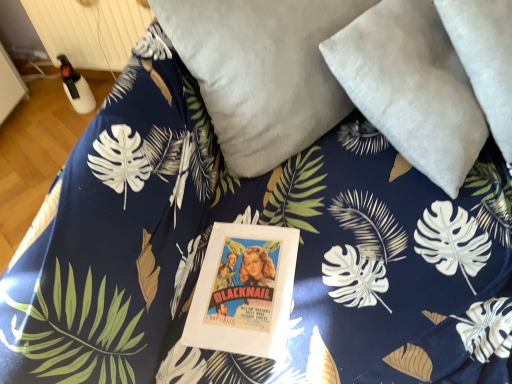
Question: Can you confirm if white plastic radiator at upper left is positioned to the left of velvety gray pillow at upper center, marked as the 1th pillow in a left-to-right arrangement?

Choices:
 (A) yes
 (B) no

Answer: (A)

Question: From a real-world perspective, is white plastic radiator at upper left on velvety gray pillow at upper center, the second pillow in the right-to-left sequence?

Choices:
 (A) no
 (B) yes

Answer: (A)

Question: Is white plastic radiator at upper left further to the viewer compared to velvety gray pillow at upper center, marked as the 1th pillow in a left-to-right arrangement?

Choices:
 (A) yes
 (B) no

Answer: (A)

Question: From the image's perspective, would you say white plastic radiator at upper left is shown under velvety gray pillow at upper center, marked as the 1th pillow in a left-to-right arrangement?

Choices:
 (A) no
 (B) yes

Answer: (A)

Question: From the image's perspective, would you say white plastic radiator at upper left is positioned over velvety gray pillow at upper center, the second pillow in the right-to-left sequence?

Choices:
 (A) yes
 (B) no

Answer: (A)

Question: Which is correct: velvety gray pillow at upper center, marked as the 1th pillow in a left-to-right arrangement, is inside suede-like gray pillow at upper right, the first pillow positioned from the right, or outside of it?

Choices:
 (A) outside
 (B) inside

Answer: (A)

Question: Does point (283, 160) appear closer or farther from the camera than point (374, 16)?

Choices:
 (A) closer
 (B) farther

Answer: (B)

Question: In terms of width, does velvety gray pillow at upper center, the second pillow in the right-to-left sequence, look wider or thinner when compared to suede-like gray pillow at upper right, the first pillow positioned from the right?

Choices:
 (A) wide
 (B) thin

Answer: (B)

Question: Considering the positions of velvety gray pillow at upper center, the second pillow in the right-to-left sequence, and suede-like gray pillow at upper right, the first pillow positioned from the right, in the image, is velvety gray pillow at upper center, the second pillow in the right-to-left sequence, bigger or smaller than suede-like gray pillow at upper right, the first pillow positioned from the right,?

Choices:
 (A) small
 (B) big

Answer: (B)

Question: Considering the positions of velvety gray pillow at upper center, the second pillow in the right-to-left sequence, and white plastic radiator at upper left in the image, is velvety gray pillow at upper center, the second pillow in the right-to-left sequence, taller or shorter than white plastic radiator at upper left?

Choices:
 (A) short
 (B) tall

Answer: (B)

Question: Considering the relative positions of velvety gray pillow at upper center, the second pillow in the right-to-left sequence, and white plastic radiator at upper left in the image provided, is velvety gray pillow at upper center, the second pillow in the right-to-left sequence, to the left or to the right of white plastic radiator at upper left?

Choices:
 (A) left
 (B) right

Answer: (B)

Question: In the image, is velvety gray pillow at upper center, the second pillow in the right-to-left sequence, positioned in front of or behind white plastic radiator at upper left?

Choices:
 (A) front
 (B) behind

Answer: (A)

Question: Considering the positions of point (239, 110) and point (60, 13), is point (239, 110) closer or farther from the camera than point (60, 13)?

Choices:
 (A) closer
 (B) farther

Answer: (A)

Question: Is white plastic radiator at upper left bigger or smaller than velvety gray pillow at upper center, marked as the 1th pillow in a left-to-right arrangement?

Choices:
 (A) small
 (B) big

Answer: (A)

Question: From a real-world perspective, is white plastic radiator at upper left above or below velvety gray pillow at upper center, marked as the 1th pillow in a left-to-right arrangement?

Choices:
 (A) below
 (B) above

Answer: (A)